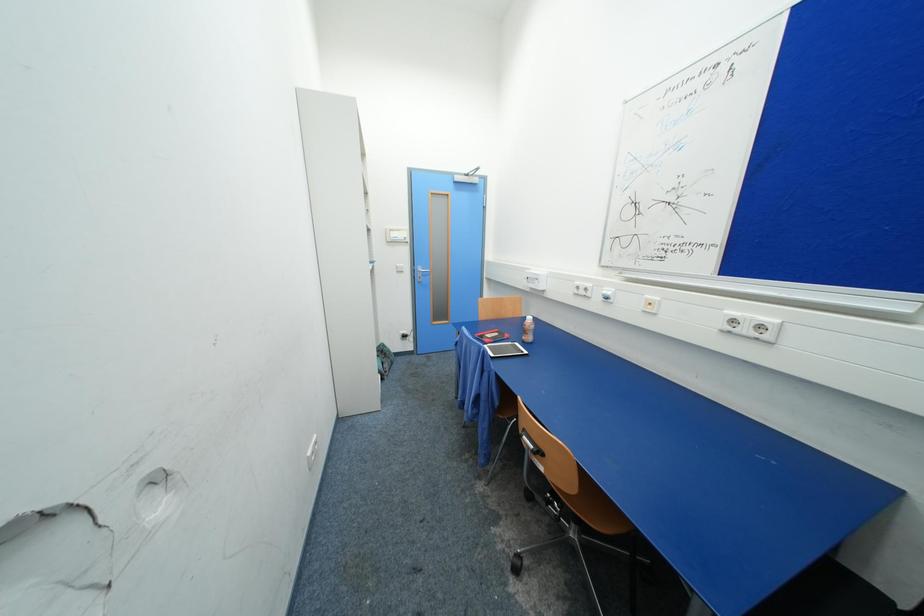
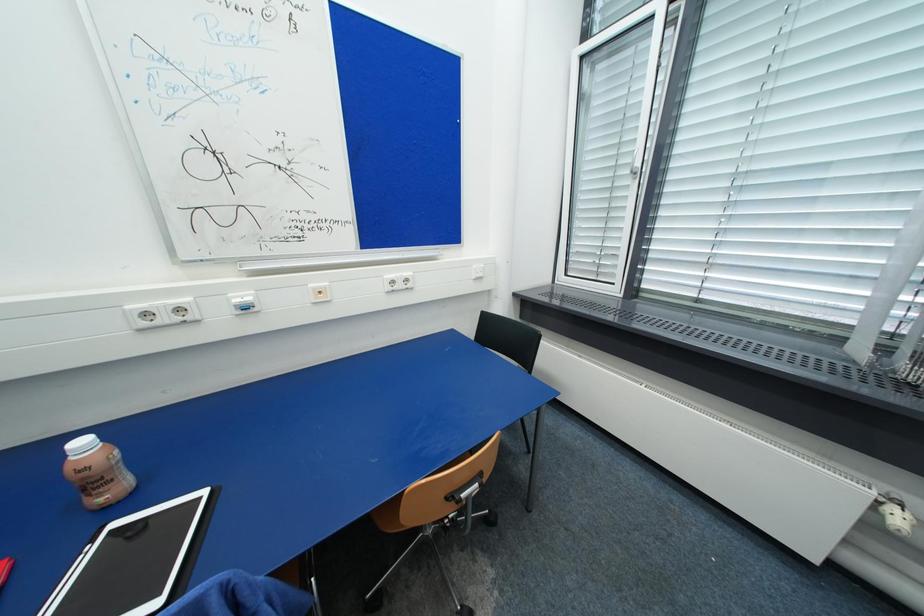
First-person continuous shooting, in which direction is the camera rotating?

The camera's rotation is toward right-down.